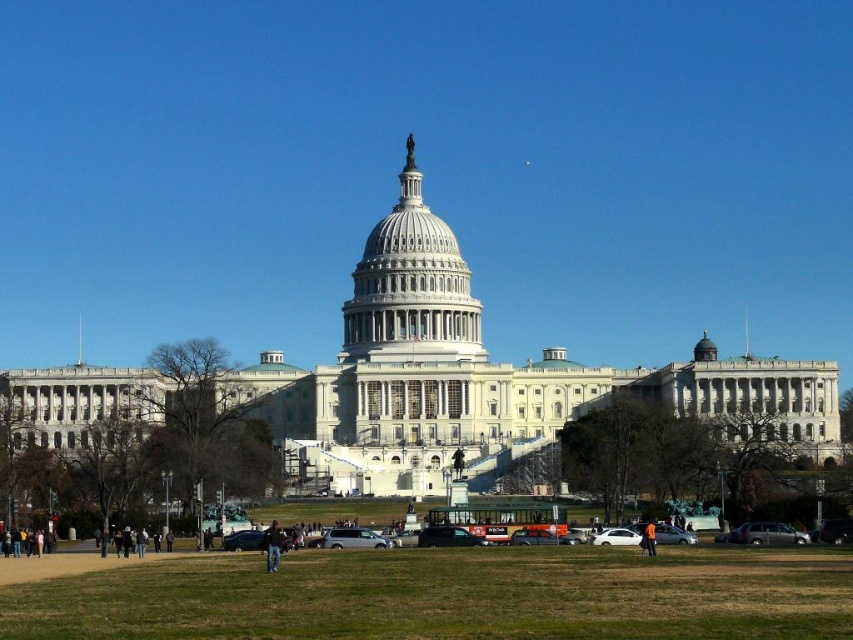
You are a tourist standing at the entrance of the United States Capitol building and want to take a photo of the white marble dome at center. If your camera can focus on objects up to 500 feet away, will you be able to capture the dome clearly?

The white marble dome at center is 429.42 feet from the camera, which is within the camera focus range of up to 500 feet. Therefore, you can capture the dome clearly.

You are standing at the point with coordinates (410, 288) in the image of the U.S. Capitol. What structure are you directly facing?

The point at coordinates (410, 288) corresponds to the white marble dome at center, so you are directly facing the white marble dome at center.

You are a photographer trying to capture a photo of the white marble dome at center and the black fabric jacket at lower center. If you want both objects to be fully visible in your frame, which one should you focus on first to ensure the entire dome is in the shot?

The white marble dome at center might be wider than black fabric jacket at lower center, so you should focus on the white marble dome at center first to ensure it fits entirely within the frame.